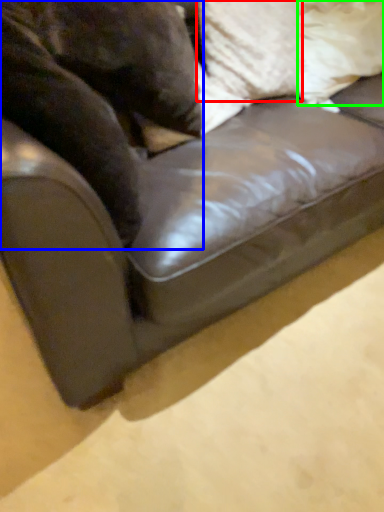
Question: Which is nearer to the pillow (highlighted by a red box)? animal (highlighted by a blue box) or pillow (highlighted by a green box).

Choices:
 (A) animal
 (B) pillow

Answer: (B)